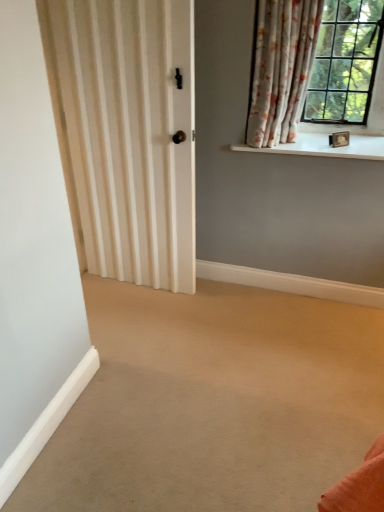
Locate an element on the screen. The height and width of the screenshot is (512, 384). floral fabric curtain at upper right is located at coordinates (281, 68).

Looking at this image, measure the distance between point (257, 22) and camera.

Point (257, 22) and camera are 6.92 feet apart from each other.

Describe the element at coordinates (281, 68) in the screenshot. I see `floral fabric curtain at upper right` at that location.

Image resolution: width=384 pixels, height=512 pixels. Find the location of `white smooth window sill at upper right`. white smooth window sill at upper right is located at coordinates (325, 146).

What do you see at coordinates (325, 146) in the screenshot? Image resolution: width=384 pixels, height=512 pixels. I see `white smooth window sill at upper right` at bounding box center [325, 146].

The image size is (384, 512). Find the location of `floral fabric curtain at upper right`. floral fabric curtain at upper right is located at coordinates point(281,68).

Considering the relative positions of floral fabric curtain at upper right and white smooth window sill at upper right in the image provided, is floral fabric curtain at upper right to the left of white smooth window sill at upper right from the viewer's perspective?

Indeed, floral fabric curtain at upper right is positioned on the left side of white smooth window sill at upper right.

Is the depth of floral fabric curtain at upper right less than that of white smooth window sill at upper right?

Yes, it is.

Does point (281, 21) lie in front of point (381, 154)?

That is True.

From the image's perspective, between floral fabric curtain at upper right and white smooth window sill at upper right, which one is located above?

floral fabric curtain at upper right appears higher in the image.

From a real-world perspective, which object rests below the other?

From a 3D spatial view, white smooth window sill at upper right is below.

Between floral fabric curtain at upper right and white smooth window sill at upper right, which one has larger width?

With larger width is white smooth window sill at upper right.

Who is shorter, floral fabric curtain at upper right or white smooth window sill at upper right?

white smooth window sill at upper right is shorter.

Between floral fabric curtain at upper right and white smooth window sill at upper right, which one has smaller size?

With smaller size is white smooth window sill at upper right.

Is floral fabric curtain at upper right located outside white smooth window sill at upper right?

That's correct, floral fabric curtain at upper right is outside of white smooth window sill at upper right.

Is floral fabric curtain at upper right touching white smooth window sill at upper right?

No, floral fabric curtain at upper right is not in contact with white smooth window sill at upper right.

Is floral fabric curtain at upper right facing away from white smooth window sill at upper right?

No, white smooth window sill at upper right is not at the back of floral fabric curtain at upper right.

How many degrees apart are the facing directions of floral fabric curtain at upper right and white smooth window sill at upper right?

0.00153 degrees.

How far apart are floral fabric curtain at upper right and white smooth window sill at upper right?

floral fabric curtain at upper right and white smooth window sill at upper right are 12.84 inches apart.

I want to click on window sill that appears behind the floral fabric curtain at upper right, so click(325, 146).

Would you say white smooth window sill at upper right is to the left or to the right of floral fabric curtain at upper right in the picture?

Clearly, white smooth window sill at upper right is on the right of floral fabric curtain at upper right in the image.

Considering the relative positions of white smooth window sill at upper right and floral fabric curtain at upper right in the image provided, is white smooth window sill at upper right behind floral fabric curtain at upper right?

Yes, the depth of white smooth window sill at upper right is greater than that of floral fabric curtain at upper right.

Looking at this image, which is nearer, (273, 146) or (259, 11)?

Point (273, 146) appears to be farther away from the viewer than point (259, 11).

From the image's perspective, which one is positioned higher, white smooth window sill at upper right or floral fabric curtain at upper right?

floral fabric curtain at upper right is shown above in the image.

From a real-world perspective, is white smooth window sill at upper right located higher than floral fabric curtain at upper right?

No, from a real-world perspective, white smooth window sill at upper right is not above floral fabric curtain at upper right.

Which of these two, white smooth window sill at upper right or floral fabric curtain at upper right, is thinner?

With smaller width is floral fabric curtain at upper right.

Who is taller, white smooth window sill at upper right or floral fabric curtain at upper right?

With more height is floral fabric curtain at upper right.

Is white smooth window sill at upper right bigger or smaller than floral fabric curtain at upper right?

Considering their sizes, white smooth window sill at upper right takes up less space than floral fabric curtain at upper right.

Does white smooth window sill at upper right contain floral fabric curtain at upper right?

No, floral fabric curtain at upper right is located outside of white smooth window sill at upper right.

Are white smooth window sill at upper right and floral fabric curtain at upper right located far from each other?

They are positioned close to each other.

Is white smooth window sill at upper right aimed at floral fabric curtain at upper right?

No, white smooth window sill at upper right is not oriented towards floral fabric curtain at upper right.

How different are the orientations of white smooth window sill at upper right and floral fabric curtain at upper right in degrees?

There is a 0.00153-degree angle between the facing directions of white smooth window sill at upper right and floral fabric curtain at upper right.

Measure the distance from white smooth window sill at upper right to floral fabric curtain at upper right.

white smooth window sill at upper right and floral fabric curtain at upper right are 12.84 inches apart from each other.

Identify the location of curtain in front of the white smooth window sill at upper right. (281, 68).

This screenshot has height=512, width=384. What are the coordinates of `window sill located underneath the floral fabric curtain at upper right (from a real-world perspective)` in the screenshot? It's located at (325, 146).

This screenshot has height=512, width=384. I want to click on curtain on the left side of white smooth window sill at upper right, so click(281, 68).